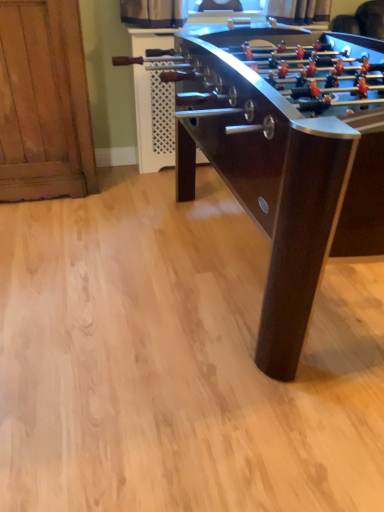
Question: Considering the positions of wooden cabinet at left and dark brown wood foosball table at center in the image, is wooden cabinet at left bigger or smaller than dark brown wood foosball table at center?

Choices:
 (A) small
 (B) big

Answer: (A)

Question: Is wooden cabinet at left inside the boundaries of dark brown wood foosball table at center, or outside?

Choices:
 (A) outside
 (B) inside

Answer: (A)

Question: From the image's perspective, relative to dark brown wood foosball table at center, is wooden cabinet at left above or below?

Choices:
 (A) above
 (B) below

Answer: (A)

Question: Considering the positions of point (218, 72) and point (49, 57), is point (218, 72) closer or farther from the camera than point (49, 57)?

Choices:
 (A) farther
 (B) closer

Answer: (B)

Question: Is dark brown wood foosball table at center taller or shorter than wooden cabinet at left?

Choices:
 (A) short
 (B) tall

Answer: (A)

Question: Considering the relative positions of dark brown wood foosball table at center and wooden cabinet at left in the image provided, is dark brown wood foosball table at center to the left or to the right of wooden cabinet at left?

Choices:
 (A) left
 (B) right

Answer: (B)

Question: Choose the correct answer: Is dark brown wood foosball table at center inside wooden cabinet at left or outside it?

Choices:
 (A) outside
 (B) inside

Answer: (A)